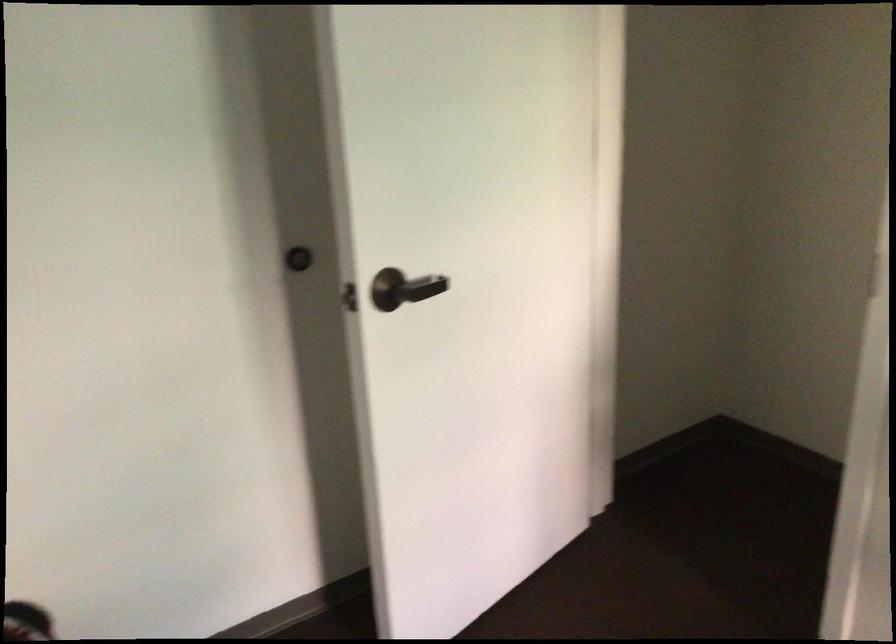
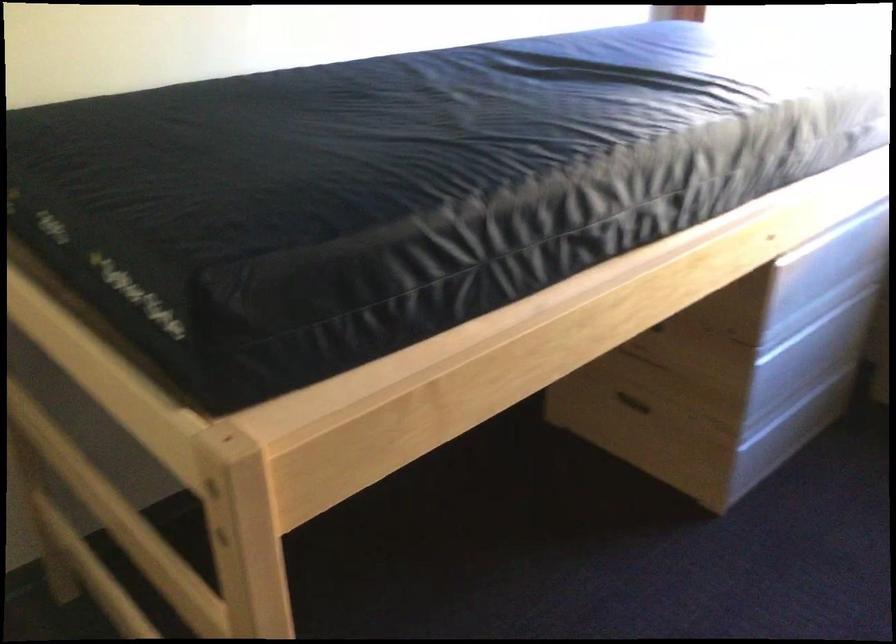
First-person continuous shooting, in which direction is the camera rotating?

The camera rotated toward right-down.